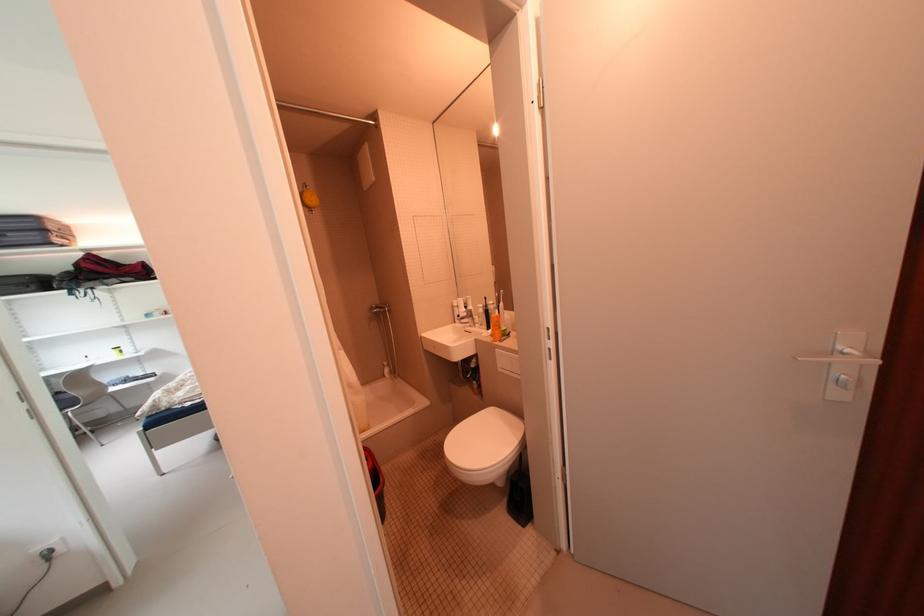
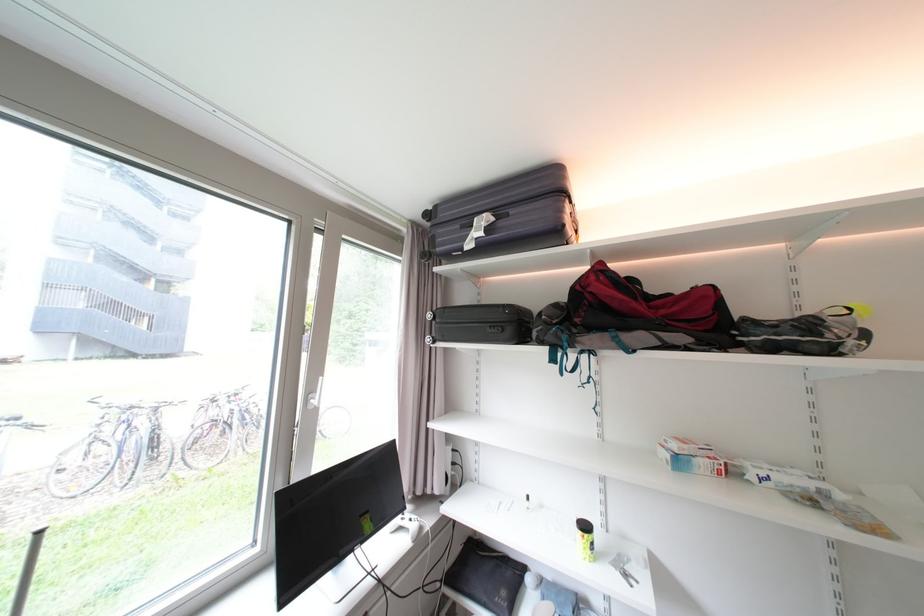
In the second image, find the point that corresponds to the point at 90,278 in the first image.

(585, 322)